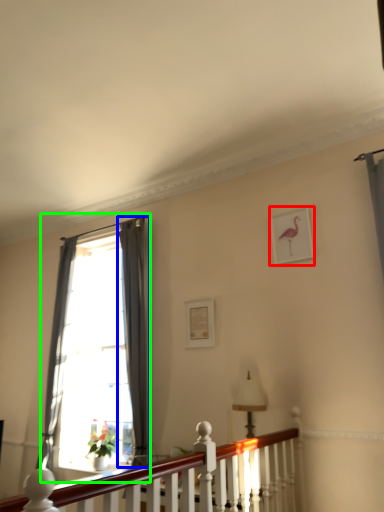
Question: Estimate the real-world distances between objects in this image. Which object is closer to picture frame (highlighted by a red box), curtain (highlighted by a blue box) or window (highlighted by a green box)?

Choices:
 (A) curtain
 (B) window

Answer: (A)